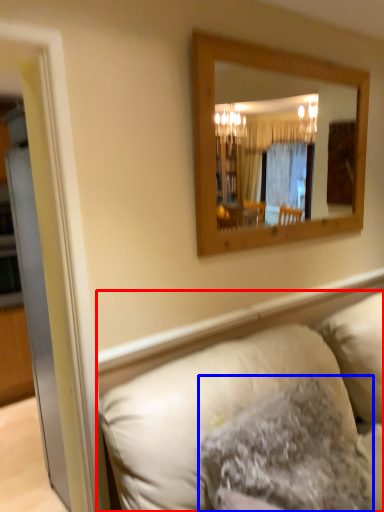
Question: Which point is further to the camera, studio couch (highlighted by a red box) or pillow (highlighted by a blue box)?

Choices:
 (A) studio couch
 (B) pillow

Answer: (B)